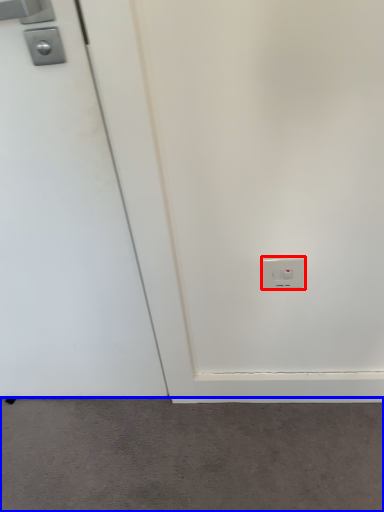
Question: Which object appears farthest to the camera in this image, power plugs and sockets (highlighted by a red box) or concrete (highlighted by a blue box)?

Choices:
 (A) power plugs and sockets
 (B) concrete

Answer: (B)